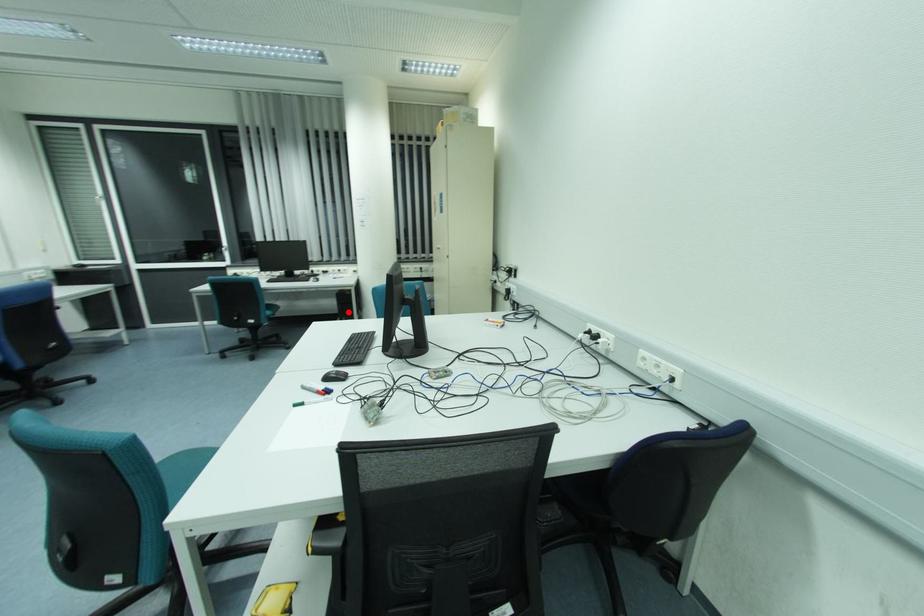
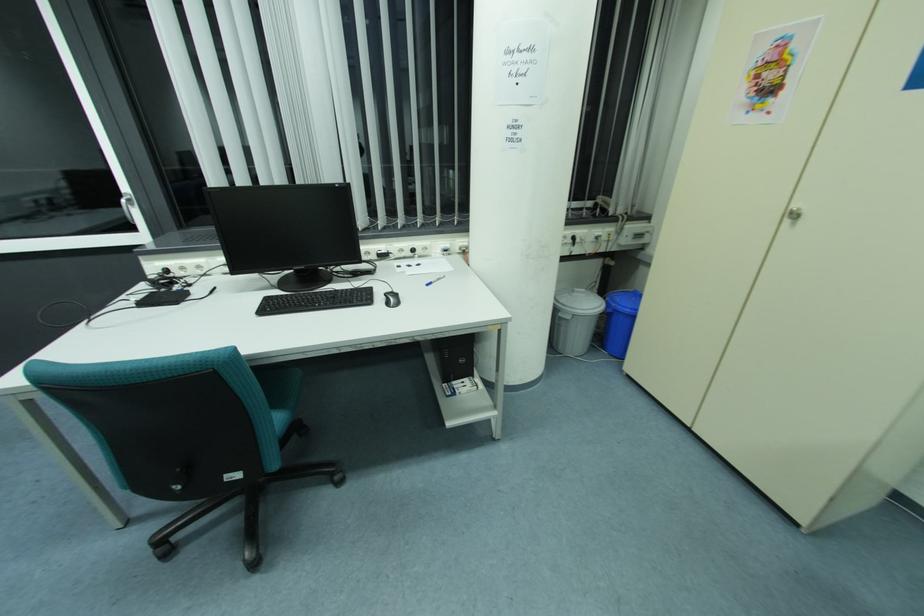
Question: I am providing you with two images of the same scene from different viewpoints. A red point is shown in image1. For the corresponding object point in image2, is it positioned nearer or farther from the camera?

Choices:
 (A) Nearer
 (B) Farther

Answer: (A)